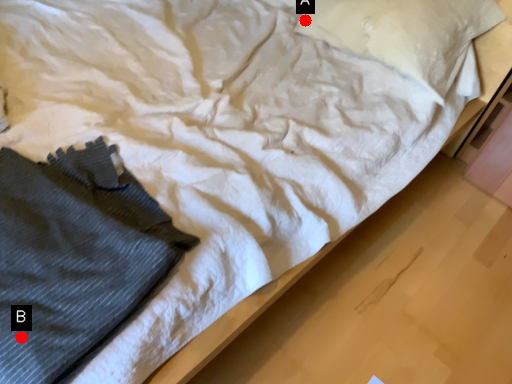
Question: Two points are circled on the image, labeled by A and B beside each circle. Which point appears closest to the camera in this image?

Choices:
 (A) A is closer
 (B) B is closer

Answer: (B)